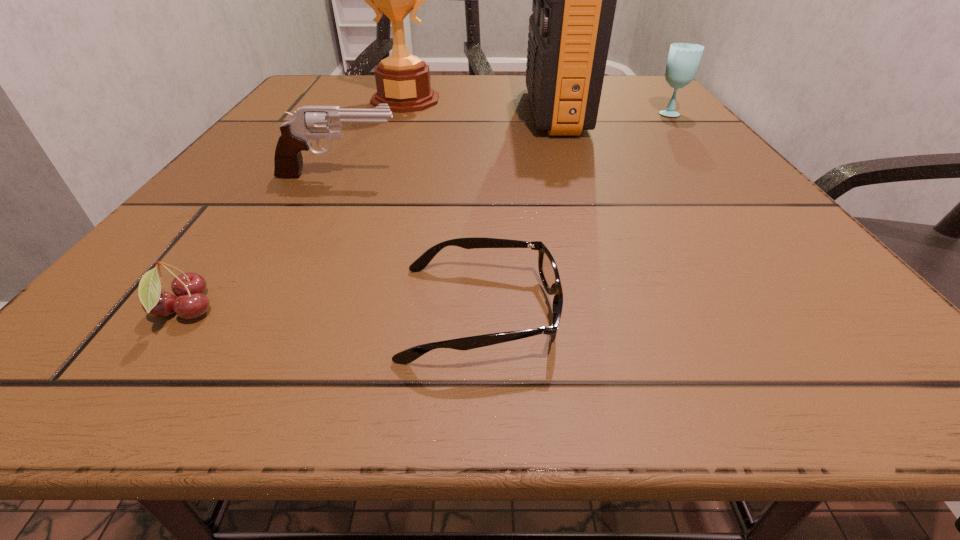
The width and height of the screenshot is (960, 540). Identify the location of free location located on the front of the rightmost object. (700, 148).

Image resolution: width=960 pixels, height=540 pixels. Find the location of `vacant space located 0.220m at the muzzle of the gun`. vacant space located 0.220m at the muzzle of the gun is located at coordinates (536, 176).

Where is `blank space located on the leaves of the cherry`? The image size is (960, 540). blank space located on the leaves of the cherry is located at coordinates (423, 311).

Where is `free space located on the front-facing side of the shortest object`? This screenshot has width=960, height=540. free space located on the front-facing side of the shortest object is located at coordinates (612, 313).

Locate an element on the screen. radio receiver present at the far edge is located at coordinates (574, 0).

Find the location of a particular element. award situated at the far edge is located at coordinates (403, 81).

At what (x,y) coordinates should I click in order to perform the action: click on glass situated at the far edge. Please return your answer as a coordinate pair (x, y). This screenshot has height=540, width=960. Looking at the image, I should click on (683, 60).

You are a GUI agent. You are given a task and a screenshot of the screen. Output one action in this format:
    pyautogui.click(x=<x>, y=<y>)
    Task: Click on the cherry at the near edge
    
    Given the screenshot: What is the action you would take?
    point(190,303)

The image size is (960, 540). I want to click on spectacles present at the near edge, so click(x=548, y=271).

Locate an element on the screen. The image size is (960, 540). award that is at the left edge is located at coordinates (403, 81).